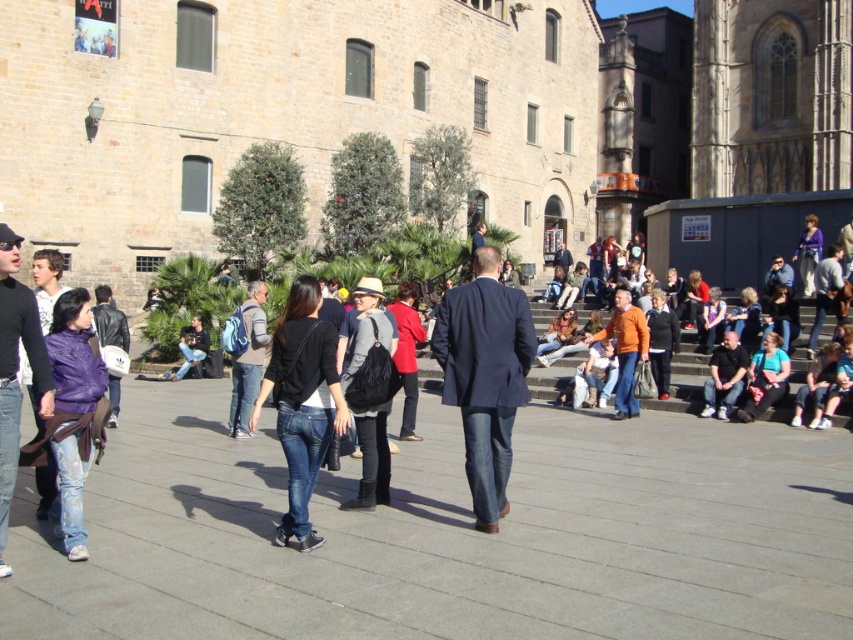
Is beige stone church at upper center smaller than denim jeans at left?

Incorrect, beige stone church at upper center is not smaller in size than denim jeans at left.

Between beige stone church at upper center and denim jeans at left, which one has less height?

denim jeans at left is shorter.

Who is more distant from viewer, (291, 115) or (1, 368)?

The point (291, 115) is more distant.

Find the location of a particular element. The height and width of the screenshot is (640, 853). beige stone church at upper center is located at coordinates (281, 113).

Can you confirm if navy blue suit at center is wider than black matte shirt at lower right?

No.

Between navy blue suit at center and black matte shirt at lower right, which one is positioned lower?

Positioned lower is navy blue suit at center.

Measure the distance between point (519, 328) and camera.

12.19 meters

You are a GUI agent. You are given a task and a screenshot of the screen. Output one action in this format:
    pyautogui.click(x=<x>, y=<y>)
    Task: Click on the navy blue suit at center
    The image size is (853, 640).
    Given the screenshot: What is the action you would take?
    pyautogui.click(x=485, y=376)

Is orange matte jacket at center closer to the viewer compared to black matte shirt at lower right?

No.

Is point (616, 326) positioned in front of point (722, 380)?

No.

The width and height of the screenshot is (853, 640). I want to click on orange matte jacket at center, so click(625, 349).

Find the location of `orange matte jacket at center`. orange matte jacket at center is located at coordinates (625, 349).